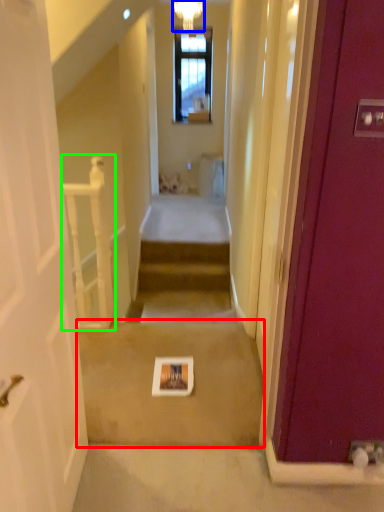
Question: Estimate the real-world distances between objects in this image. Which object is closer to path (highlighted by a red box), light fixture (highlighted by a blue box) or balustrade (highlighted by a green box)?

Choices:
 (A) light fixture
 (B) balustrade

Answer: (B)